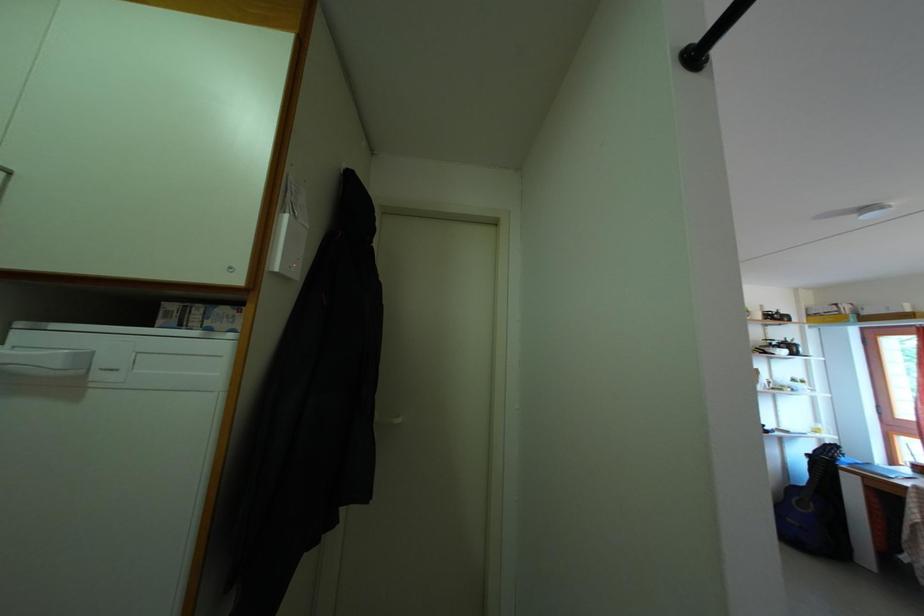
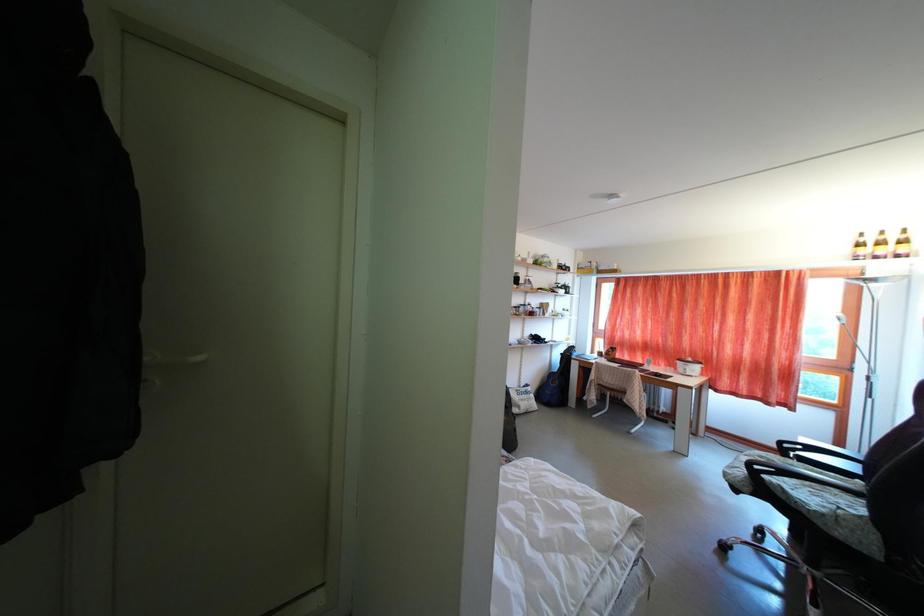
Question: The images are taken continuously from a first-person perspective. In which direction is your viewpoint rotating?

Choices:
 (A) Left
 (B) Right
 (C) Up
 (D) Down

Answer: (B)